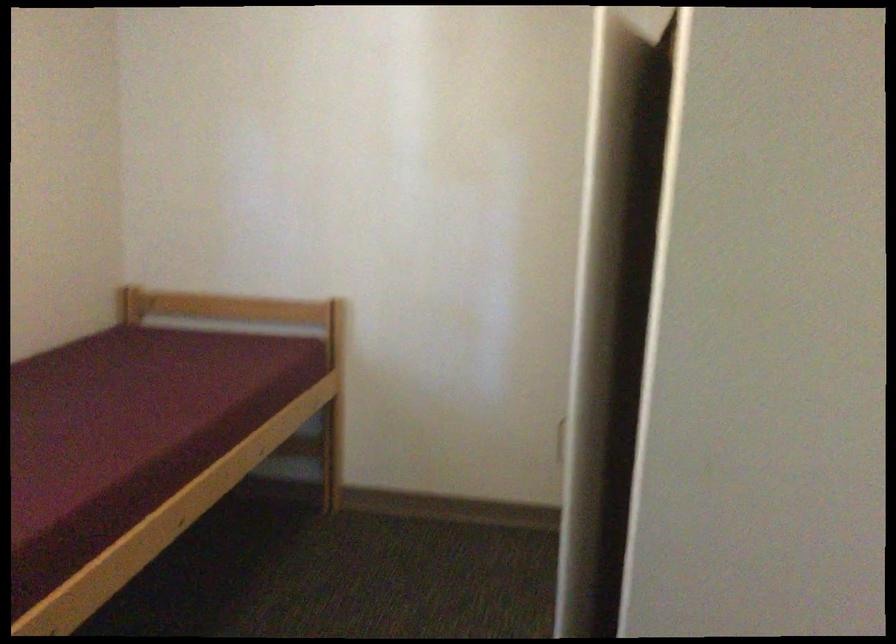
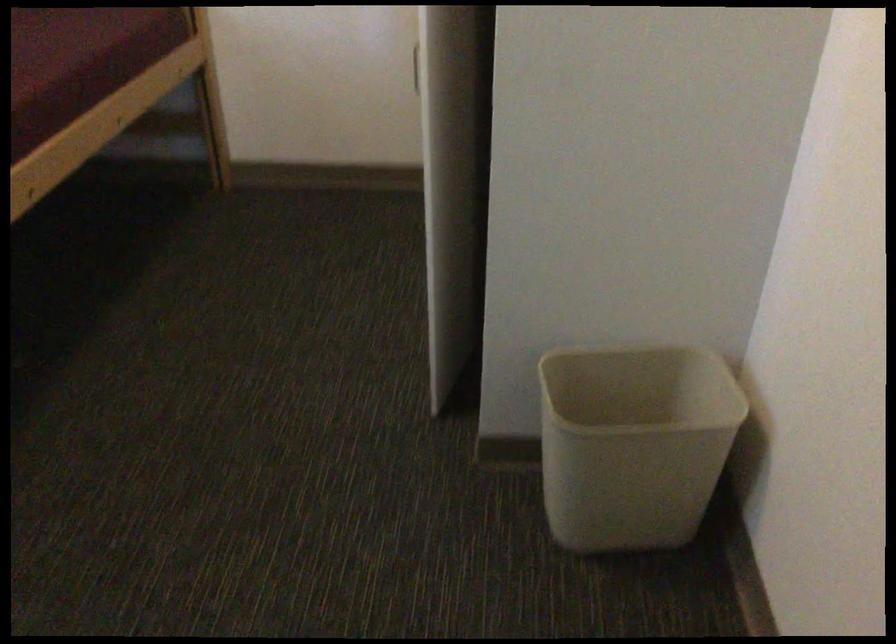
What movement of the cameraman would produce the second image?

The movement direction of the cameraman is right, forward.